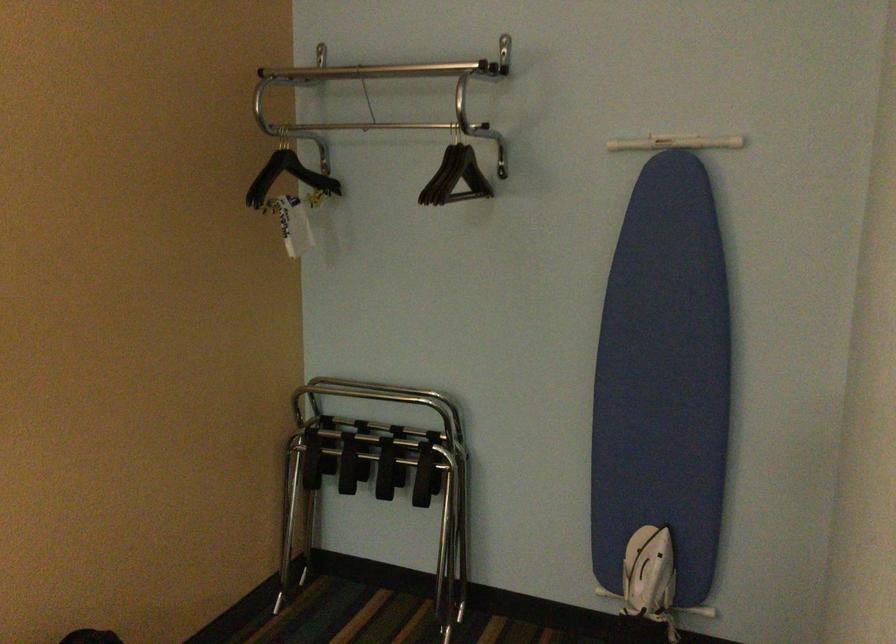
The height and width of the screenshot is (644, 896). In order to click on white cloth bag in this screenshot , I will do `click(650, 579)`.